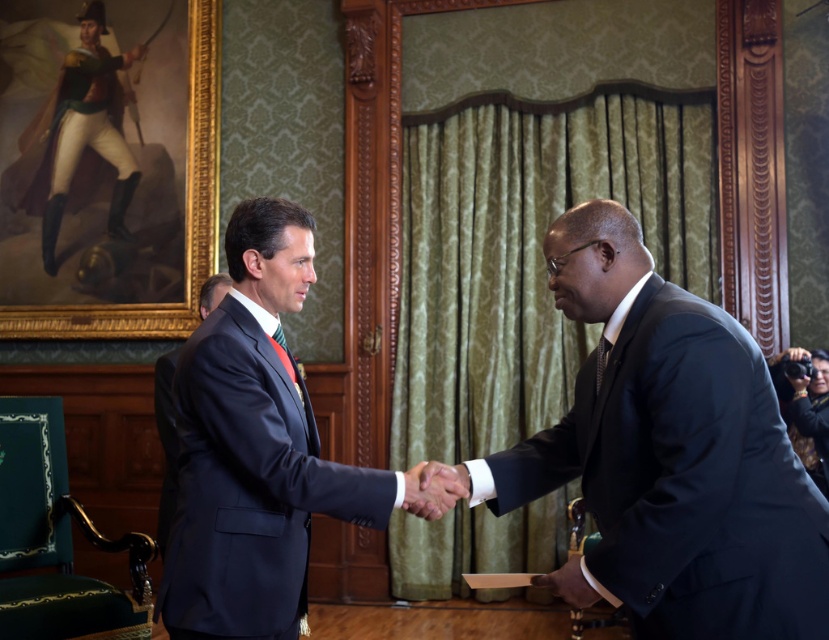
Which is in front, point (697, 608) or point (253, 348)?

Point (697, 608) is more forward.

Between dark blue suit at center and matte black suit at center, which one has more height?

Standing taller between the two is matte black suit at center.

Measure the distance between point (658, 276) and camera.

The distance of point (658, 276) from camera is 1.95 meters.

Locate an element on the screen. This screenshot has width=829, height=640. dark blue suit at center is located at coordinates (668, 454).

Which is more to the right, matte black suit at center or matte green uniform at upper left?

Positioned to the right is matte black suit at center.

Is matte black suit at center below matte green uniform at upper left?

Yes.

Between point (221, 589) and point (61, 104), which one is positioned behind?

The point (61, 104) is behind.

Locate an element on the screen. This screenshot has height=640, width=829. matte black suit at center is located at coordinates (253, 449).

Does dark blue suit at center have a lesser width compared to white glossy hand at center?

In fact, dark blue suit at center might be wider than white glossy hand at center.

Can you confirm if dark blue suit at center is positioned above white glossy hand at center?

Yes.

Image resolution: width=829 pixels, height=640 pixels. What do you see at coordinates (668, 454) in the screenshot?
I see `dark blue suit at center` at bounding box center [668, 454].

Locate an element on the screen. This screenshot has width=829, height=640. dark blue suit at center is located at coordinates (668, 454).